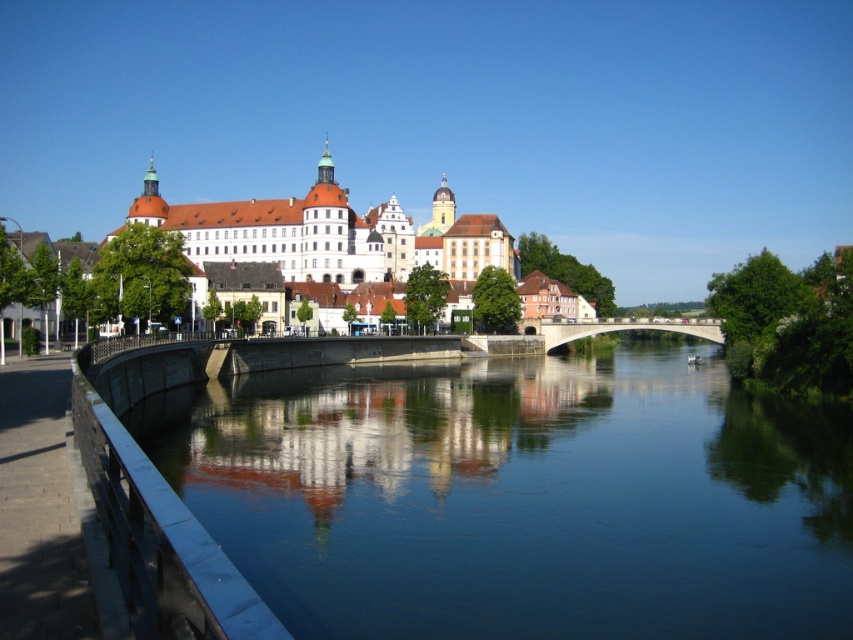
Question: Can you confirm if smooth concrete river at center is positioned below white stone castle at center?

Choices:
 (A) yes
 (B) no

Answer: (A)

Question: Among these objects, which one is farthest from the camera?

Choices:
 (A) concrete bridge at center
 (B) white stone castle at center
 (C) smooth concrete river at center

Answer: (A)

Question: Does smooth concrete river at center come in front of concrete bridge at center?

Choices:
 (A) yes
 (B) no

Answer: (A)

Question: Which point is closer to the camera?

Choices:
 (A) (625, 500)
 (B) (698, 321)
 (C) (517, 266)

Answer: (A)

Question: From the image, what is the correct spatial relationship of smooth concrete river at center in relation to concrete bridge at center?

Choices:
 (A) right
 (B) left

Answer: (B)

Question: Which of the following is the farthest from the observer?

Choices:
 (A) smooth concrete river at center
 (B) white stone castle at center

Answer: (B)